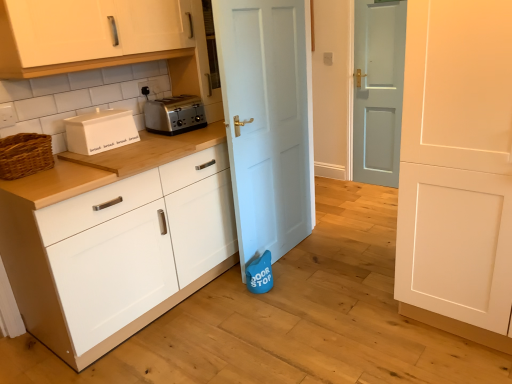
Question: Considering the relative sizes of white matte bread bin at left and light blue matte door at center, acting as the second door starting from the front, in the image provided, is white matte bread bin at left smaller than light blue matte door at center, acting as the second door starting from the front,?

Choices:
 (A) no
 (B) yes

Answer: (B)

Question: Considering the relative positions of white matte bread bin at left and light blue matte door at center, acting as the second door starting from the front, in the image provided, is white matte bread bin at left to the left of light blue matte door at center, acting as the second door starting from the front, from the viewer's perspective?

Choices:
 (A) yes
 (B) no

Answer: (A)

Question: Would you say white matte bread bin at left contains light blue matte door at center, the 2th door positioned from the back?

Choices:
 (A) no
 (B) yes

Answer: (A)

Question: Can you confirm if white matte bread bin at left is bigger than light blue matte door at center, acting as the second door starting from the front?

Choices:
 (A) yes
 (B) no

Answer: (B)

Question: From a real-world perspective, is white matte bread bin at left physically above light blue matte door at center, the 2th door positioned from the back?

Choices:
 (A) yes
 (B) no

Answer: (A)

Question: Visually, is white matte cabinet at center, the first cabinetry from the bottom, positioned to the left or to the right of satin silver toaster at center?

Choices:
 (A) right
 (B) left

Answer: (A)

Question: In the image, is white matte cabinet at center, which appears as the second cabinetry when viewed from the top, positioned in front of or behind satin silver toaster at center?

Choices:
 (A) front
 (B) behind

Answer: (A)

Question: Considering the positions of white matte cabinet at center, which appears as the second cabinetry when viewed from the top, and satin silver toaster at center in the image, is white matte cabinet at center, which appears as the second cabinetry when viewed from the top, wider or thinner than satin silver toaster at center?

Choices:
 (A) thin
 (B) wide

Answer: (B)

Question: Is point (113, 91) positioned closer to the camera than point (182, 114)?

Choices:
 (A) closer
 (B) farther

Answer: (B)

Question: Would you say white glossy cabinet at upper left, placed as the second cabinetry when sorted from bottom to top, is to the left or to the right of light blue wooden door at center, acting as the first door starting from the back, in the picture?

Choices:
 (A) right
 (B) left

Answer: (B)

Question: In terms of size, does white glossy cabinet at upper left, which is counted as the first cabinetry, starting from the top, appear bigger or smaller than light blue wooden door at center, which is counted as the third door, starting from the front?

Choices:
 (A) small
 (B) big

Answer: (B)

Question: In terms of height, does white glossy cabinet at upper left, which is counted as the first cabinetry, starting from the top, look taller or shorter compared to light blue wooden door at center, which is counted as the third door, starting from the front?

Choices:
 (A) short
 (B) tall

Answer: (A)

Question: Looking at their shapes, would you say white glossy cabinet at upper left, placed as the second cabinetry when sorted from bottom to top, is wider or thinner than light blue wooden door at center, which is counted as the third door, starting from the front?

Choices:
 (A) wide
 (B) thin

Answer: (A)

Question: Do you think white matte bread bin at left is within light blue matte door at center, acting as the second door starting from the front, or outside of it?

Choices:
 (A) inside
 (B) outside

Answer: (B)

Question: Is white matte bread bin at left wider or thinner than light blue matte door at center, the 2th door positioned from the back?

Choices:
 (A) thin
 (B) wide

Answer: (B)